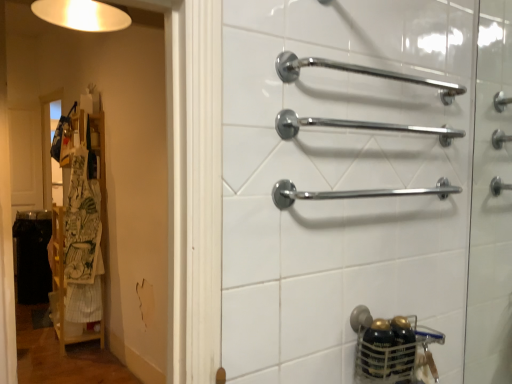
Question: Is white cotton apron at left wider or thinner than chrome metallic grab bars at right?

Choices:
 (A) thin
 (B) wide

Answer: (B)

Question: In terms of size, does white cotton apron at left appear bigger or smaller than chrome metallic grab bars at right?

Choices:
 (A) small
 (B) big

Answer: (B)

Question: Considering the real-world distances, which object is closest to the chrome metallic towel rack at upper center, positioned as the first towel rack in top-to-bottom order?

Choices:
 (A) chrome metallic grab bars at right
 (B) polished chrome towel bar at center, which is the 3th towel rack from top to bottom
 (C) chrome metallic towel rack at center, the 2th towel rack when ordered from bottom to top
 (D) white cotton apron at left
 (E) wooden rack at left

Answer: (C)

Question: Which is nearer to the polished chrome towel bar at center, which appears as the first towel rack when ordered from the bottom?

Choices:
 (A) chrome metallic towel rack at upper center, positioned as the first towel rack in top-to-bottom order
 (B) white cotton apron at left
 (C) wooden rack at left
 (D) chrome metallic grab bars at right
 (E) chrome metallic towel rack at center, the 2th towel rack when ordered from bottom to top

Answer: (E)